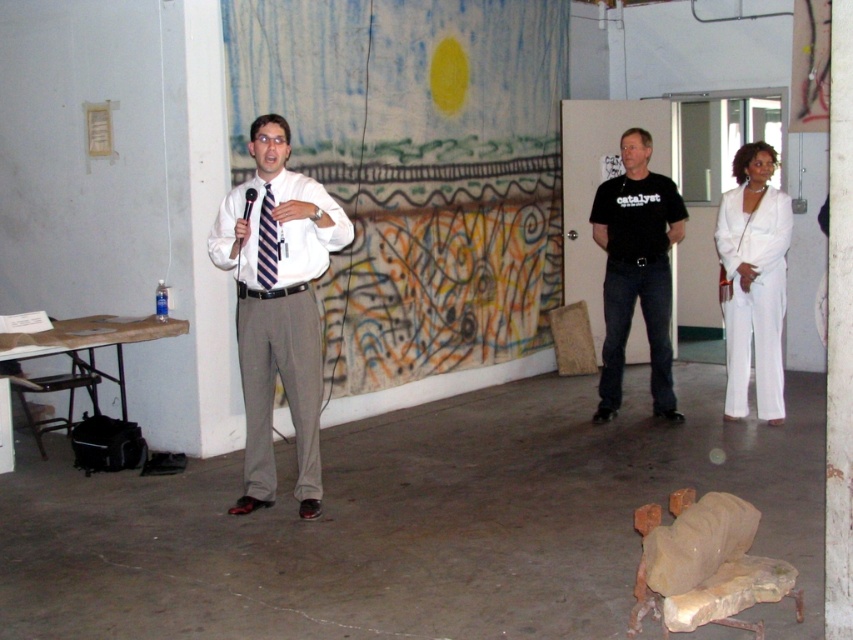
Question: Is matte white shirt at center below white satin pantsuit at right?

Choices:
 (A) yes
 (B) no

Answer: (A)

Question: Can you confirm if black cotton t-shirt at center is smaller than white smooth dress shirt at center?

Choices:
 (A) no
 (B) yes

Answer: (A)

Question: Can you confirm if black cotton t-shirt at center is positioned to the left of white satin pantsuit at right?

Choices:
 (A) yes
 (B) no

Answer: (A)

Question: Which point is farther to the camera?

Choices:
 (A) black cotton t-shirt at center
 (B) striped fabric tie at center
 (C) white satin pantsuit at right
 (D) matte white shirt at center

Answer: (A)

Question: Based on their relative distances, which object is nearer to the white satin pantsuit at right?

Choices:
 (A) striped fabric tie at center
 (B) matte white shirt at center
 (C) white smooth dress shirt at center

Answer: (B)

Question: Among these objects, which one is nearest to the camera?

Choices:
 (A) white smooth dress shirt at center
 (B) matte white shirt at center

Answer: (B)